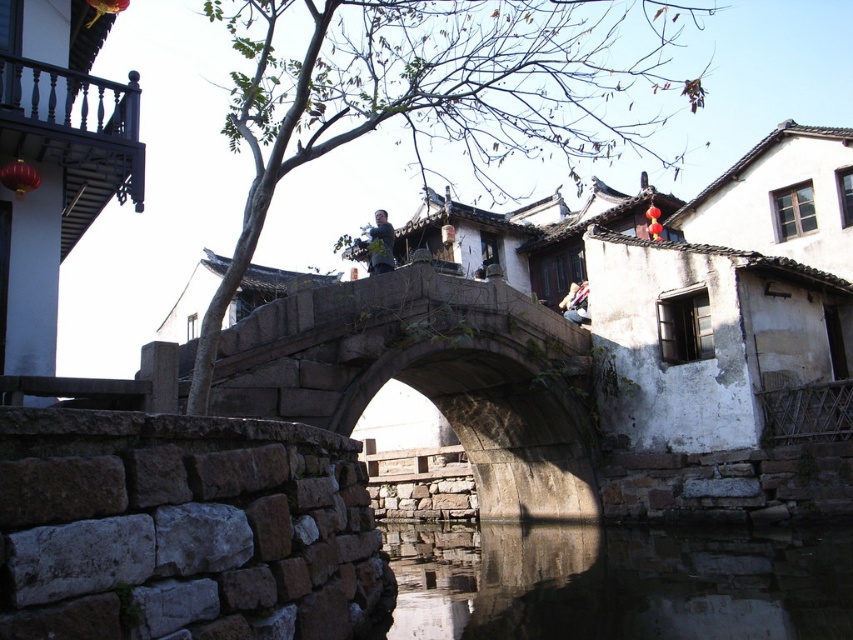
You are standing at the stone bridge in the image and want to determine which of the two points, point (486, 528) or point (569, 296), is nearer to you. Based on the scene description, which point is closer?

Point (486, 528) is closer to the viewer than point (569, 296).

You are a tourist standing at the entrance of the village and want to take a photo of the stone bridge at center and the matte gray statue at center. Which one should you focus on first to ensure both are in the frame?

The stone bridge at center is in front of the matte gray statue at center, so you should focus on the stone bridge at center first to ensure both are in the frame.

You are a traveler carrying a large wooden crate that is 3 meters wide. You need to cross the stone bridge at center to reach the other side of the smooth stone water at center. Can your crate fit on the bridge?

The stone bridge at center is narrower than the smooth stone water at center, but the width comparison between the bridge and the crate isn not provided. Without knowing the exact width of the bridge, it is impossible to determine if the crate will fit.